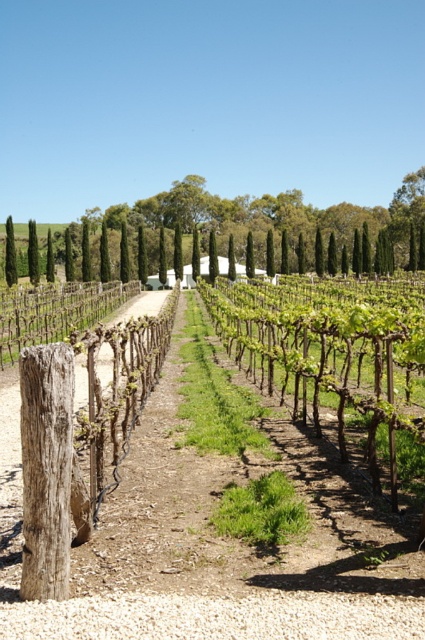
Is point (2, 332) farther from viewer compared to point (14, 262)?

No, (2, 332) is closer to viewer.

This screenshot has height=640, width=425. I want to click on brown wooden fence at center, so click(x=56, y=312).

Does point (82, 296) lie behind point (8, 244)?

No, (82, 296) is in front of (8, 244).

Where is `brown wooden fence at center`? brown wooden fence at center is located at coordinates (56, 312).